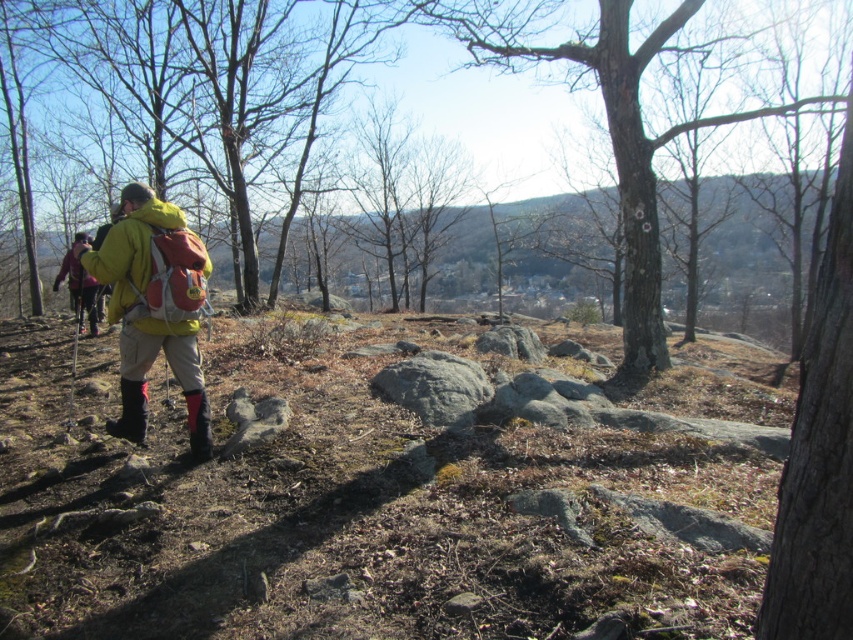
Question: Can you confirm if yellow fleece jacket at center is positioned to the left of rubber/matte boot at lower left?

Choices:
 (A) yes
 (B) no

Answer: (B)

Question: Which of these objects is positioned closest to the rubber/matte boot at lower left?

Choices:
 (A) rubber/matte boot at lower center
 (B) yellow fleece jacket at center
 (C) matte yellow jacket at center
 (D) matte pink jacket at left

Answer: (C)

Question: Does yellow fleece jacket at center appear over rubber/matte boot at lower left?

Choices:
 (A) yes
 (B) no

Answer: (A)

Question: Which of the following is the farthest from the observer?

Choices:
 (A) (122, 324)
 (B) (128, 428)
 (C) (80, 280)

Answer: (C)

Question: From the image, what is the correct spatial relationship of yellow fleece jacket at center in relation to rubber/matte boot at lower left?

Choices:
 (A) left
 (B) right

Answer: (B)

Question: Which of these objects is positioned farthest from the rubber/matte boot at lower center?

Choices:
 (A) matte yellow jacket at center
 (B) yellow fleece jacket at center
 (C) matte pink jacket at left

Answer: (C)